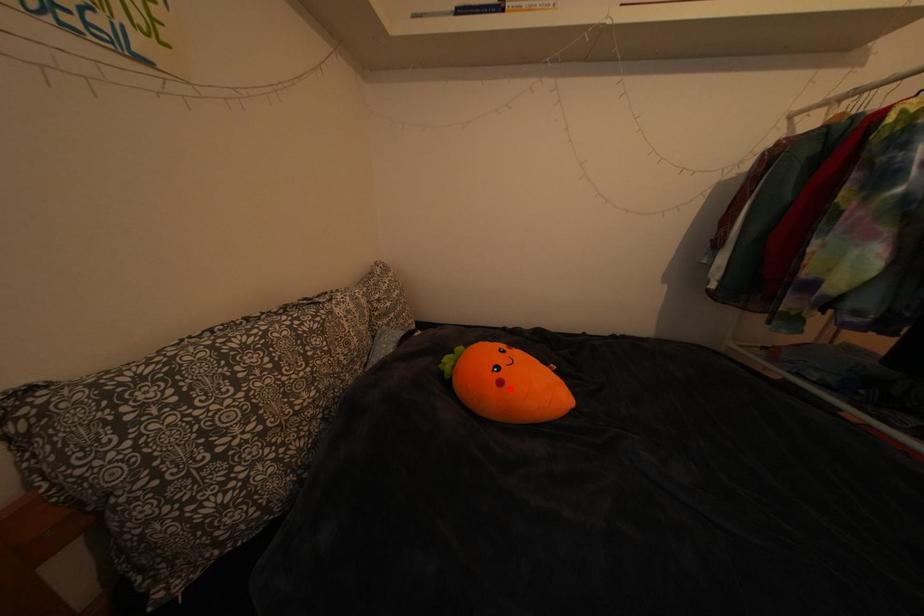
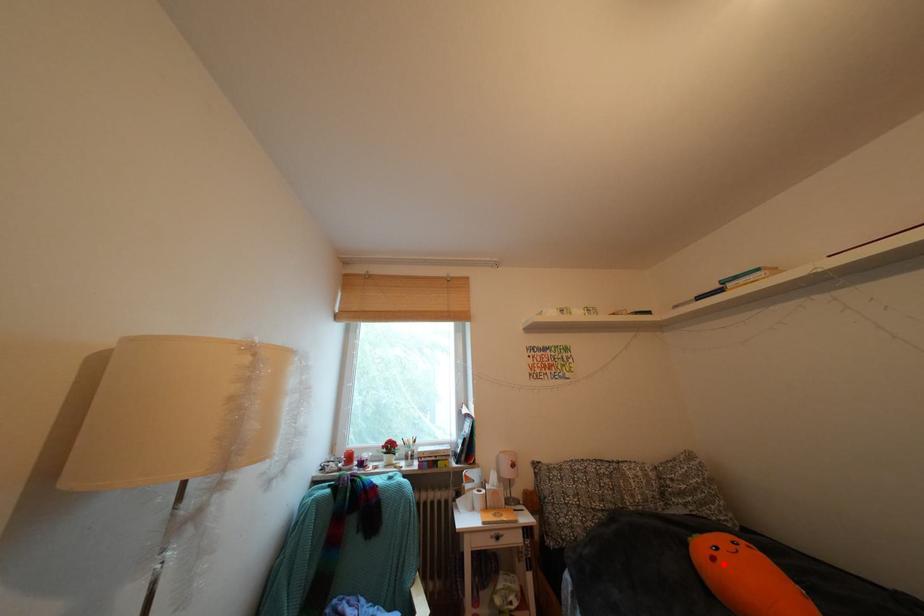
I am providing you with two images of the same scene from different viewpoints. A red point is marked on the first image and another point is marked on the second image. Do the highlighted points in image1 and image2 indicate the same real-world spot?

Yes